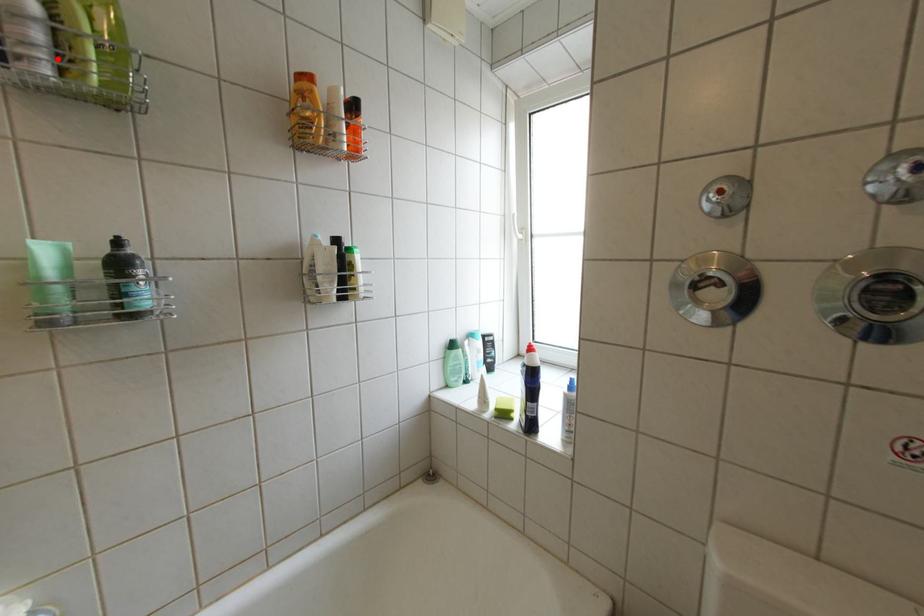
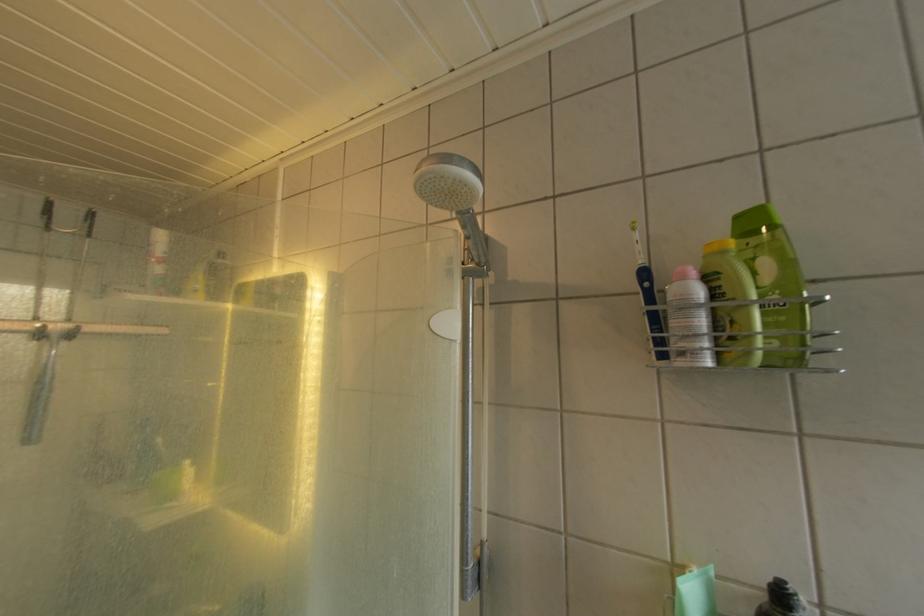
The point at the highlighted location is marked in the first image. Where is the corresponding point in the second image?

(719, 345)